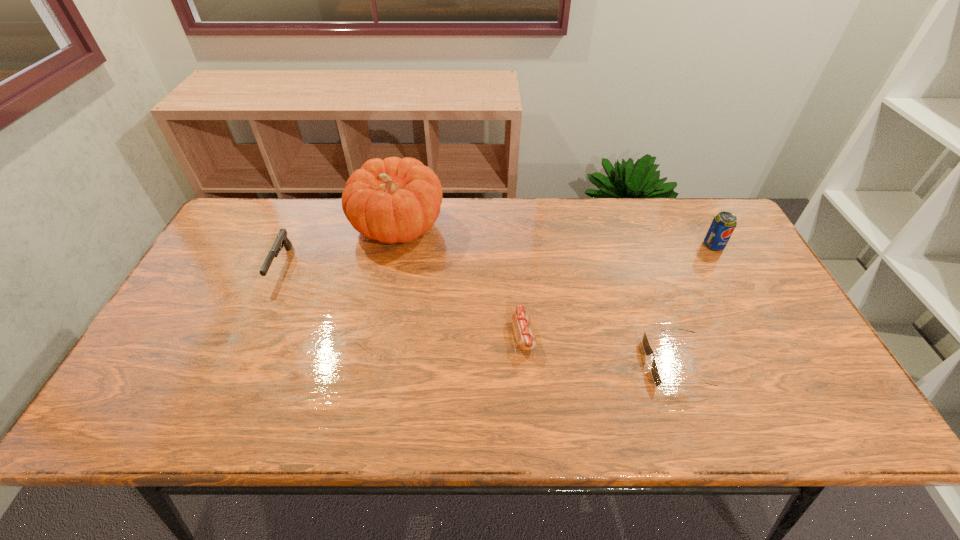
At what (x,y) coordinates should I click in order to perform the action: click on object at the right edge. Please return your answer as a coordinate pair (x, y). The width and height of the screenshot is (960, 540). Looking at the image, I should click on (723, 224).

Locate an element on the screen. The image size is (960, 540). object that is at the far right corner is located at coordinates (723, 224).

In the image, there is a desktop. At what (x,y) coordinates should I click in order to perform the action: click on vacant space at the far edge. Please return your answer as a coordinate pair (x, y). Image resolution: width=960 pixels, height=540 pixels. Looking at the image, I should click on (294, 200).

You are a GUI agent. You are given a task and a screenshot of the screen. Output one action in this format:
    pyautogui.click(x=<x>, y=<y>)
    Task: Click on the vacant area at the left edge
    This screenshot has width=960, height=540.
    Given the screenshot: What is the action you would take?
    click(208, 368)

In the image, there is a desktop. Where is `vacant space at the right edge`? The width and height of the screenshot is (960, 540). vacant space at the right edge is located at coordinates (809, 377).

In the image, there is a desktop. Where is `vacant space at the far right corner`? vacant space at the far right corner is located at coordinates (x=685, y=214).

Find the location of a particular element. The height and width of the screenshot is (540, 960). unoccupied position between the shortest object and the second tallest object is located at coordinates (694, 305).

Image resolution: width=960 pixels, height=540 pixels. I want to click on vacant space that is in between the fourth object from left to right and the sausage, so click(x=599, y=349).

Find the location of a particular element. The height and width of the screenshot is (540, 960). free space between the second object from right to left and the sausage is located at coordinates (599, 349).

At what (x,y) coordinates should I click in order to perform the action: click on vacant space that is in between the sunglasses and the second object from left to right. Please return your answer as a coordinate pair (x, y). The height and width of the screenshot is (540, 960). Looking at the image, I should click on (537, 295).